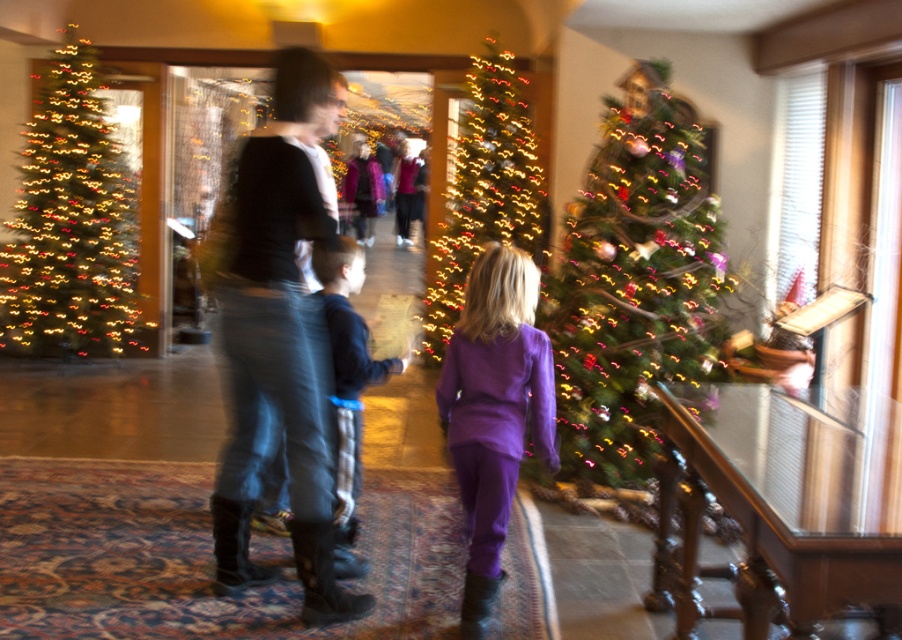
In the scene shown: Does dark blue jeans at center appear on the left side of velvet purple coat at center?

In fact, dark blue jeans at center is to the right of velvet purple coat at center.

Who is positioned more to the right, dark blue jeans at center or velvet purple coat at center?

dark blue jeans at center

I want to click on dark blue jeans at center, so click(347, 385).

Does point (594, 321) lie behind point (85, 342)?

No, (594, 321) is closer to viewer.

Where is `shiny green tree at center`? The height and width of the screenshot is (640, 902). shiny green tree at center is located at coordinates (633, 280).

Which of these two, purple matte pants at center or illuminated glass christmas tree at center, stands taller?

illuminated glass christmas tree at center is taller.

Does point (489, 435) come in front of point (425, 349)?

Yes.

The width and height of the screenshot is (902, 640). Identify the location of purple matte pants at center. (494, 406).